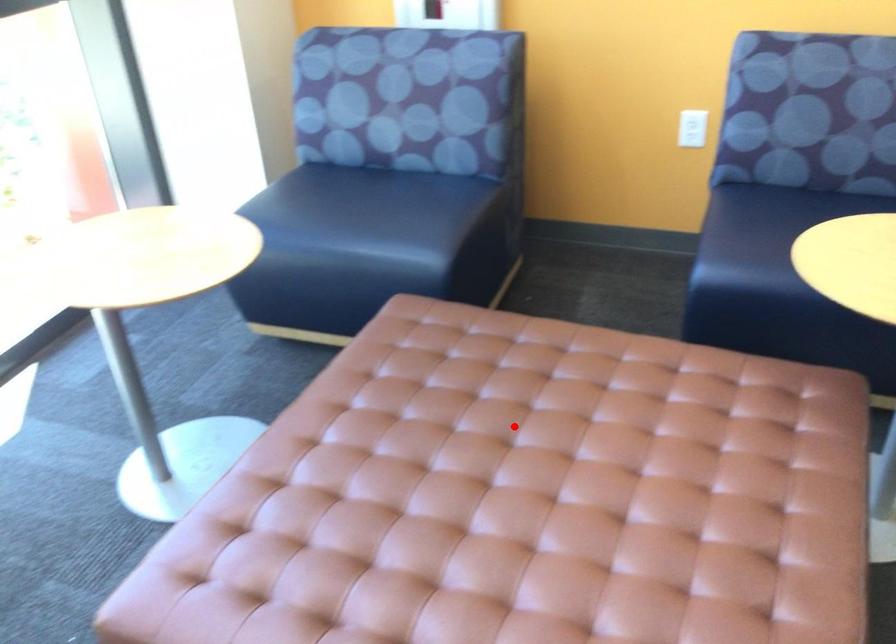
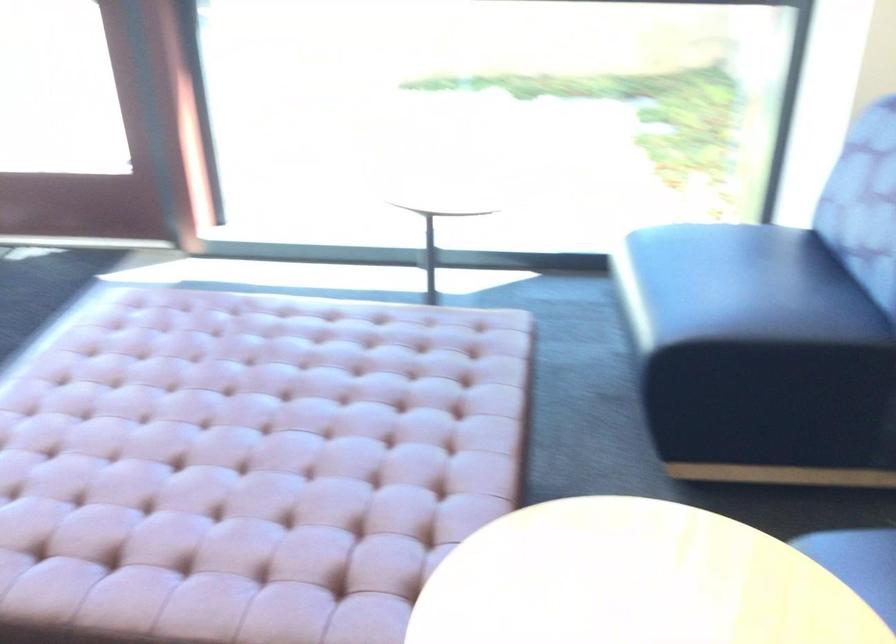
The point at the highlighted location is marked in the first image. Where is the corresponding point in the second image?

(306, 406)